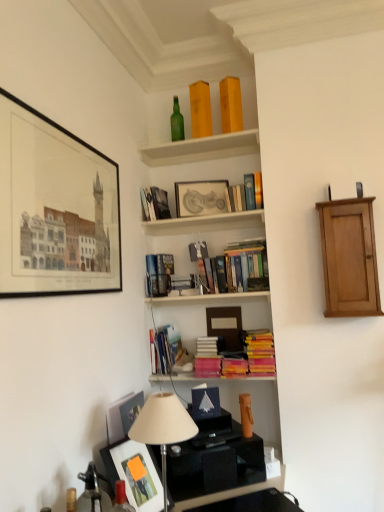
In order to click on empty space that is ontop of light brown wood cabinet at right in this screenshot , I will do `click(341, 200)`.